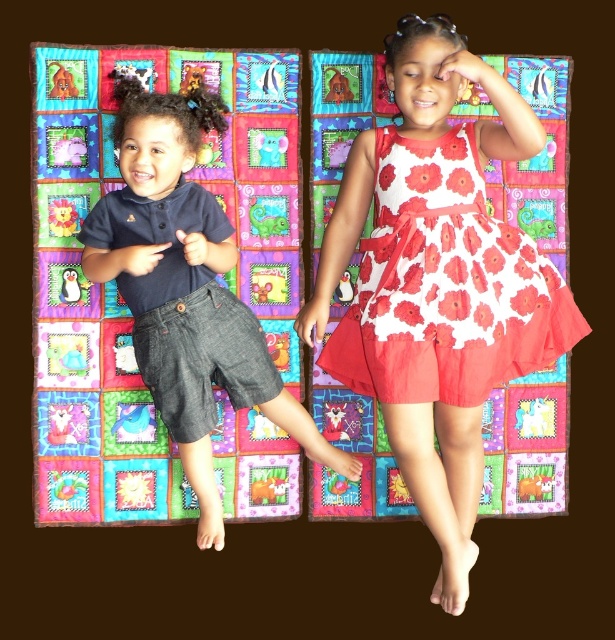
You are a photographer trying to capture a clear shot of the multicolored quilt at center and the white floral dress at center. Since you want both subjects to be visible in the frame, which object should you focus on first to ensure it doesn

The multicolored quilt at center has a lesser height compared to the white floral dress at center, so you should focus on the white floral dress at center first to ensure it is in clear view before adjusting the camera angle to include the quilt.

You are a parent standing next to a multicolored quilt at center. Your child is playing with a 10 feet long ribbon. Can the child reach the ribbon from where they are lying on the quilt?

The multicolored quilt at center and viewer are 7.54 feet apart. Since the ribbon is 10 feet long, the child can reach it if they stretch out the ribbon fully.